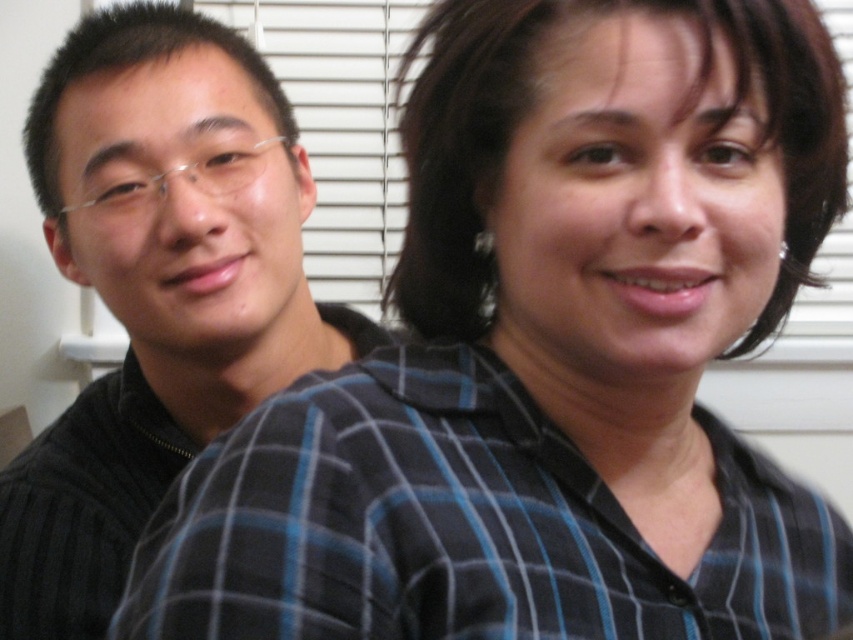
You are a photographer setting up a shoot in this scene. You need to ensure that the blue plaid shirt at center and the matte black sweater at left are both visible in the frame. Based on their positions, which object is closer to the camera?

A: The blue plaid shirt at center is in front of the matte black sweater at left, so it is closer to the camera.

You are a photographer setting up a portrait session. You notice the blue plaid shirt at center and the matte black sweater at left in your frame. To ensure both subjects are in focus, you need to adjust your camera settings based on their heights. Which subject should you prioritize focusing on first?

The blue plaid shirt at center has a lesser height compared to the matte black sweater at left. Therefore, you should prioritize focusing on the matte black sweater at left first since it is taller and might require more precise focus adjustment.

You are a photographer setting up a shoot in the room described. You need to place a light source to the left of the blue plaid shirt at center. Where should you position it to ensure it doesn not cast a shadow on the window with horizontal blinds?

Since the blue plaid shirt at center is located at point (461,525), placing the light source to its left would be appropriate. However, to avoid casting shadows on the window with horizontal blinds, ensure the light is positioned slightly above and to the left of the blue plaid shirt at center so that the light direction faces away from the window.